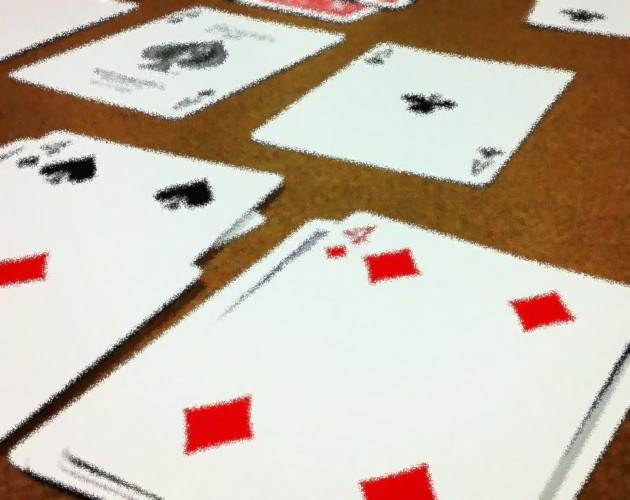
Identify the location of brown table. The height and width of the screenshot is (500, 630). (508, 210).